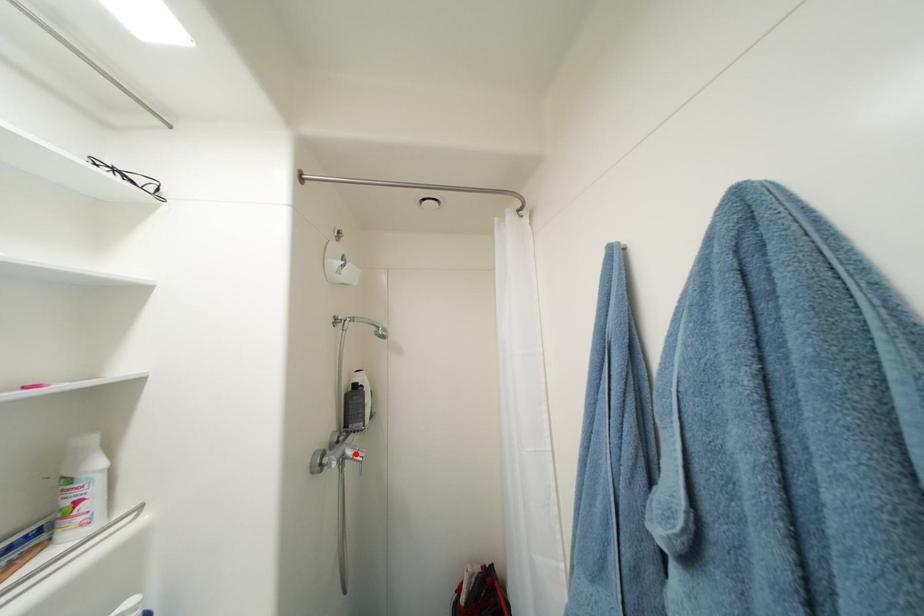
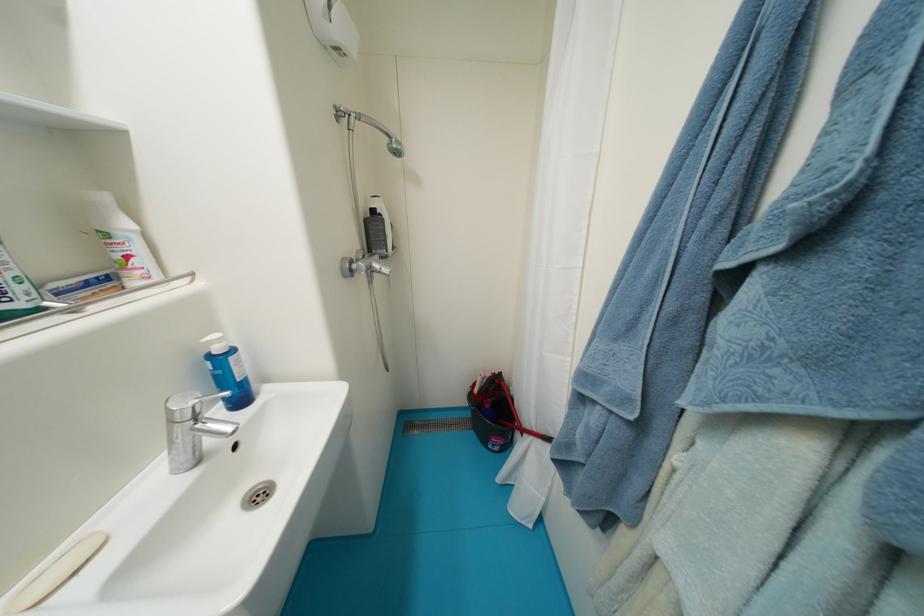
The point at the highlighted location is marked in the first image. Where is the corresponding point in the second image?

(383, 267)